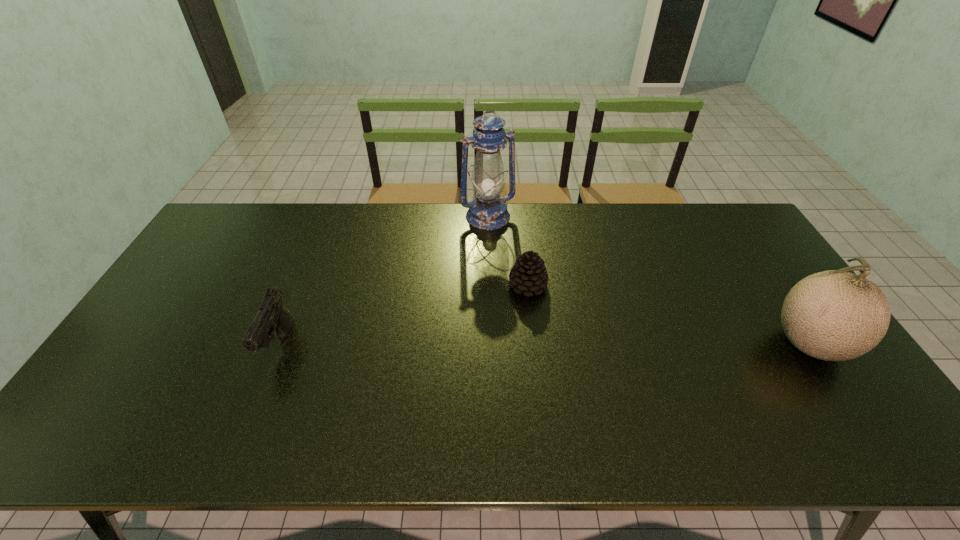
The image size is (960, 540). Identify the location of the leftmost object. [271, 316].

This screenshot has height=540, width=960. In order to click on the second tallest object in this screenshot , I will do `click(834, 315)`.

Find the location of a particular element. The width and height of the screenshot is (960, 540). the rightmost object is located at coordinates (834, 315).

Where is `the tallest object`? the tallest object is located at coordinates (487, 211).

You are a GUI agent. You are given a task and a screenshot of the screen. Output one action in this format:
    pyautogui.click(x=<x>, y=<y>)
    Task: Click on the lantern
    Image resolution: width=960 pixels, height=540 pixels.
    Given the screenshot: What is the action you would take?
    pyautogui.click(x=487, y=211)

The image size is (960, 540). In order to click on the second farthest object in this screenshot , I will do `click(529, 275)`.

Where is `vacant space located on the left of the second tallest object`? vacant space located on the left of the second tallest object is located at coordinates (624, 343).

In order to click on free space located on the front-facing side of the tallest object in this screenshot , I will do `click(533, 296)`.

Locate an element on the screen. free space located on the front-facing side of the tallest object is located at coordinates click(x=529, y=289).

This screenshot has height=540, width=960. I want to click on free region located on the front-facing side of the tallest object, so click(536, 301).